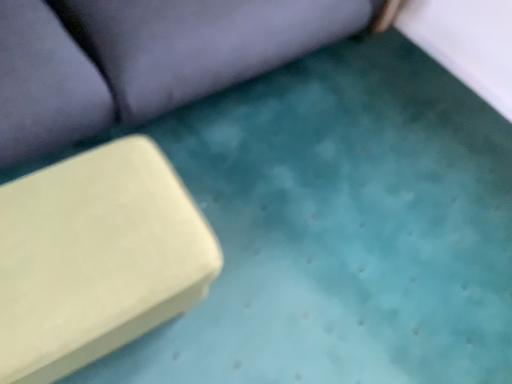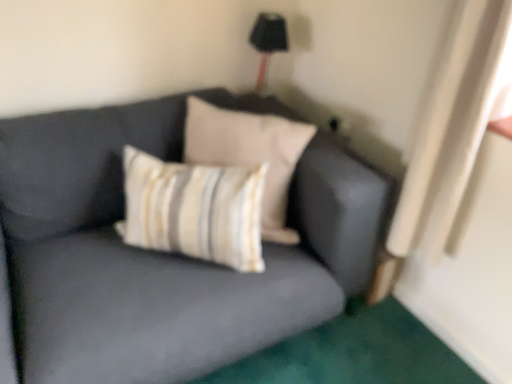
Question: How did the camera likely rotate when shooting the video?

Choices:
 (A) rotated left
 (B) rotated right

Answer: (A)